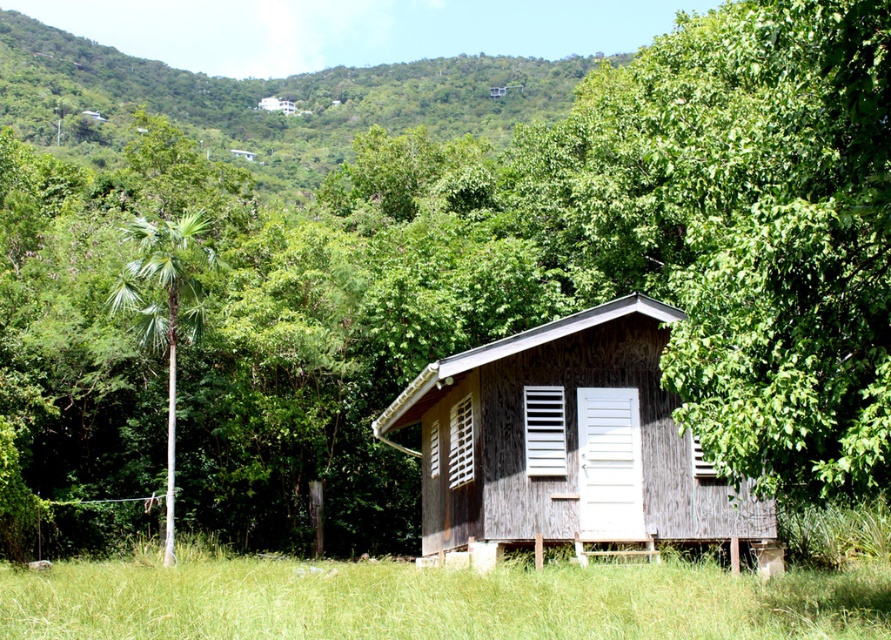
You are standing in front of the cabin and notice two features at the center of the cabin. One is the white matte vent at center and the other is the wooden slats at center. Which one is located to the right when viewed from the front?

The white matte vent at center is positioned on the right side of wooden slats at center, so when viewed from the front, the white matte vent at center is to the right of the wooden slats at center.

You are standing at the base of the palm tree to the left of the cabin and want to walk towards the cabin. There are two points marked on the path leading to the cabin. Which point, point (479, 605) or point (399, 410), is closer to the cabin?

Point (479, 605) is closer to the cabin because it is in front of point (399, 410), meaning it is nearer to the cabin than the other point.

You are standing at the base of the tall palm tree to the left of the cabin. You want to walk directly to the green grass at lower center. How far will you have to walk?

The green grass at lower center is 9.12 meters away from the viewer, so you will have to walk 9.12 meters to reach it.